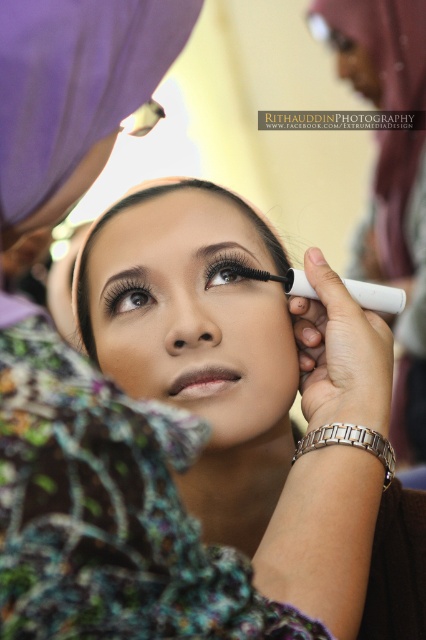
Question: Does matte pink lipstick at lower center have a greater width compared to black matte eye at center?

Choices:
 (A) yes
 (B) no

Answer: (A)

Question: Among these objects, which one is nearest to the camera?

Choices:
 (A) matte pink lipstick at lower center
 (B) black matte eye at center
 (C) matte black mascara at upper center

Answer: (A)

Question: Which point is farther to the camera?

Choices:
 (A) (215, 547)
 (B) (233, 241)
 (C) (402, 10)
 (D) (224, 273)

Answer: (C)

Question: Can you confirm if matte white mascara at upper center is wider than brown matte eyebrow at upper left?

Choices:
 (A) yes
 (B) no

Answer: (A)

Question: Which point is farther to the camera?

Choices:
 (A) black matte eye at center
 (B) matte white mascara at upper center
 (C) matte black mascara at upper center
 (D) brown matte eyebrow at upper left

Answer: (C)

Question: Can you confirm if matte black mascara at upper center is positioned below matte pink lipstick at lower center?

Choices:
 (A) yes
 (B) no

Answer: (B)